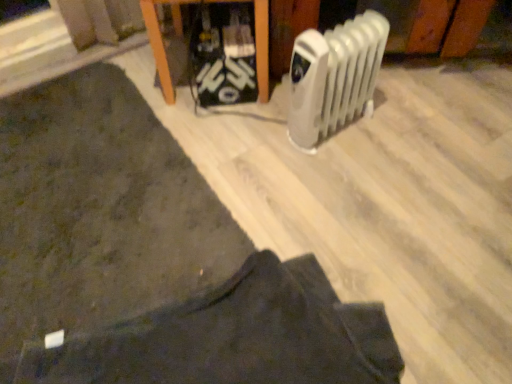
Question: Is dark fabric pants at lower center directly adjacent to white plastic radiator at right?

Choices:
 (A) no
 (B) yes

Answer: (A)

Question: Is dark fabric pants at lower center at the left side of white plastic radiator at right?

Choices:
 (A) yes
 (B) no

Answer: (A)

Question: Is dark fabric pants at lower center further to camera compared to white plastic radiator at right?

Choices:
 (A) no
 (B) yes

Answer: (A)

Question: Is dark fabric pants at lower center positioned beyond the bounds of white plastic radiator at right?

Choices:
 (A) yes
 (B) no

Answer: (A)

Question: From the image's perspective, is dark fabric pants at lower center located above white plastic radiator at right?

Choices:
 (A) no
 (B) yes

Answer: (A)

Question: Is point (245, 253) positioned closer to the camera than point (254, 317)?

Choices:
 (A) closer
 (B) farther

Answer: (B)

Question: Is dark fabric mat at lower left inside or outside of dark fabric pants at lower center?

Choices:
 (A) outside
 (B) inside

Answer: (A)

Question: From a real-world perspective, relative to dark fabric pants at lower center, is dark fabric mat at lower left vertically above or below?

Choices:
 (A) below
 (B) above

Answer: (B)

Question: Is dark fabric mat at lower left to the left or to the right of dark fabric pants at lower center in the image?

Choices:
 (A) right
 (B) left

Answer: (B)

Question: Would you say wooden table at upper center is inside or outside dark fabric pants at lower center?

Choices:
 (A) inside
 (B) outside

Answer: (B)

Question: Considering the positions of point (272, 3) and point (290, 319), is point (272, 3) closer or farther from the camera than point (290, 319)?

Choices:
 (A) farther
 (B) closer

Answer: (A)

Question: Based on their positions, is wooden table at upper center located to the left or right of dark fabric pants at lower center?

Choices:
 (A) right
 (B) left

Answer: (B)

Question: From the image's perspective, relative to dark fabric pants at lower center, is wooden table at upper center above or below?

Choices:
 (A) above
 (B) below

Answer: (A)

Question: In terms of width, does dark fabric pants at lower center look wider or thinner when compared to dark fabric mat at lower left?

Choices:
 (A) thin
 (B) wide

Answer: (A)

Question: From a real-world perspective, relative to dark fabric mat at lower left, is dark fabric pants at lower center vertically above or below?

Choices:
 (A) below
 (B) above

Answer: (A)